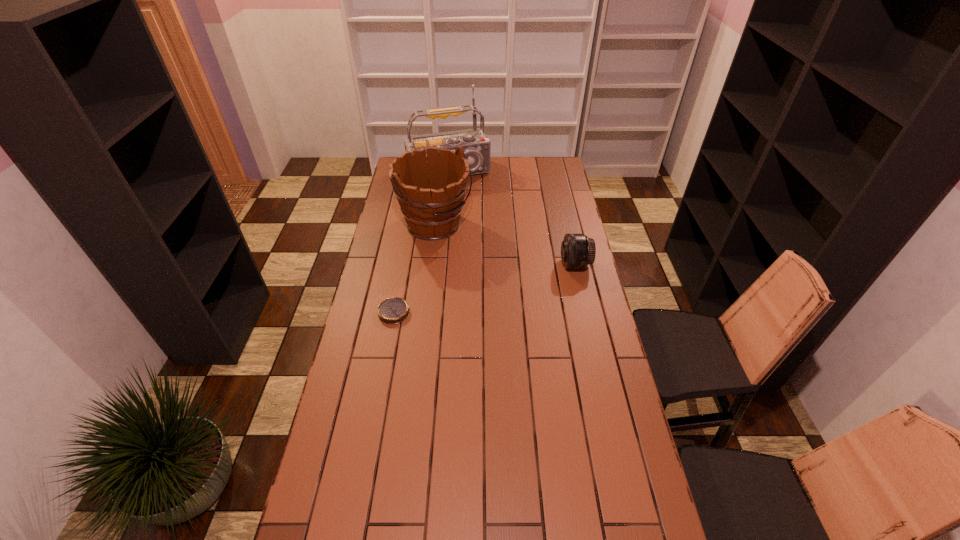
At what (x,y) coordinates should I click in order to perform the action: click on free spot between the second shortest object and the nearest object. Please return your answer as a coordinate pair (x, y). Looking at the image, I should click on (485, 288).

Find the location of `unoccupied position between the radio receiver and the compass`. unoccupied position between the radio receiver and the compass is located at coordinates (421, 242).

Identify the location of free spot between the compass and the second farthest object. The width and height of the screenshot is (960, 540). (415, 268).

The image size is (960, 540). I want to click on vacant space that's between the wine bucket and the rightmost object, so click(505, 245).

Where is `blank region between the radio receiver and the telephoto lens`? Image resolution: width=960 pixels, height=540 pixels. blank region between the radio receiver and the telephoto lens is located at coordinates coord(512,218).

Image resolution: width=960 pixels, height=540 pixels. Find the location of `object that is the third closest to the second nearest object`. object that is the third closest to the second nearest object is located at coordinates (394, 310).

Where is `object that is the second closest to the telephoto lens`? This screenshot has width=960, height=540. object that is the second closest to the telephoto lens is located at coordinates (476, 146).

Where is `free point that satisfies the following two spatial constraints: 1. on the front side of the third nearest object; 2. on the front-facing side of the rightmost object`? This screenshot has height=540, width=960. free point that satisfies the following two spatial constraints: 1. on the front side of the third nearest object; 2. on the front-facing side of the rightmost object is located at coordinates (430, 265).

This screenshot has width=960, height=540. I want to click on blank area in the image that satisfies the following two spatial constraints: 1. on the back side of the third shortest object; 2. on the left side of the shortest object, so click(410, 225).

Locate an element on the screen. Image resolution: width=960 pixels, height=540 pixels. free spot that satisfies the following two spatial constraints: 1. on the back side of the wine bucket; 2. on the right side of the radio receiver is located at coordinates (442, 172).